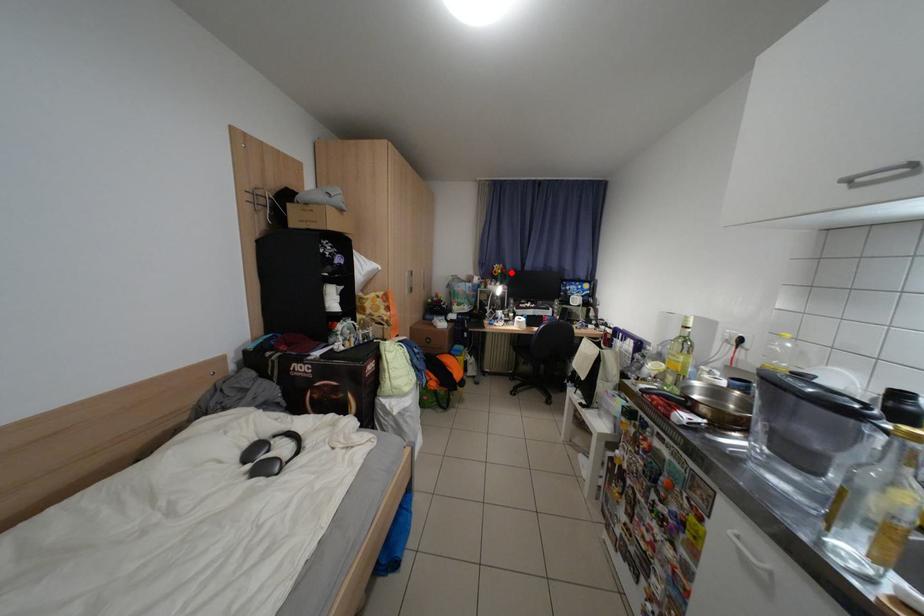
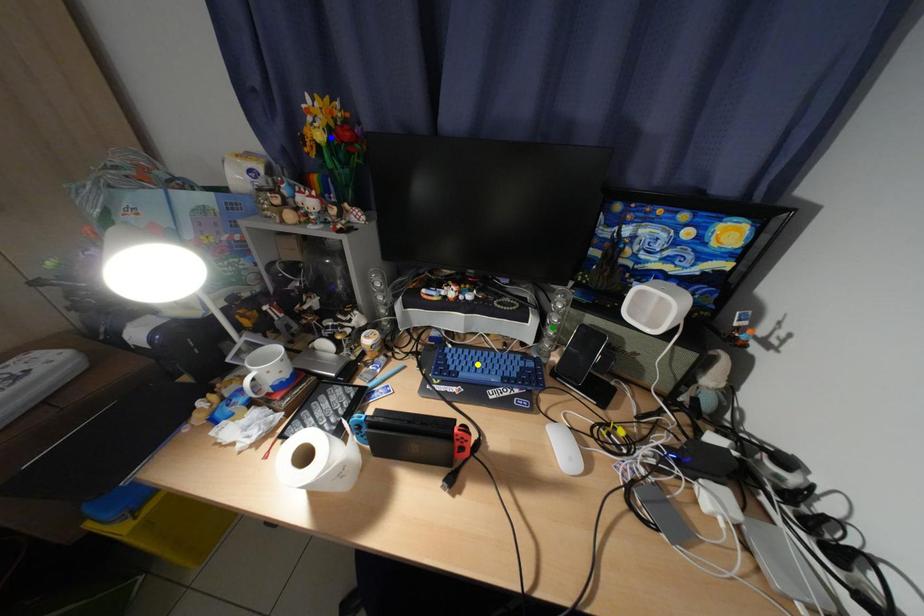
Question: I am providing you with two images of the same scene from different viewpoints. A red point is marked on the first image. You are given multiple points on the second image. In image 2, which mark is for the same physical point as the one in image 1?

Choices:
 (A) blue point
 (B) green point
 (C) yellow point

Answer: (A)